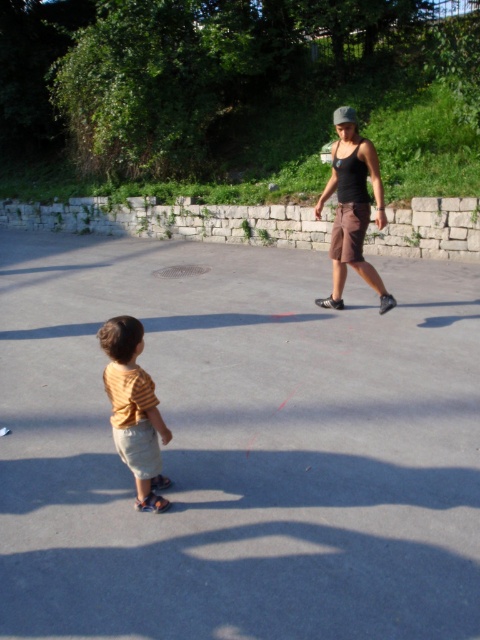
Question: Which of the following is the closest to the observer?

Choices:
 (A) yellow striped shirt at left
 (B) black matte tank top at center

Answer: (A)

Question: Is yellow striped shirt at left bigger than black matte tank top at center?

Choices:
 (A) no
 (B) yes

Answer: (A)

Question: Can you confirm if yellow striped shirt at left is wider than black matte tank top at center?

Choices:
 (A) no
 (B) yes

Answer: (A)

Question: Is yellow striped shirt at left thinner than black matte tank top at center?

Choices:
 (A) no
 (B) yes

Answer: (B)

Question: Among these points, which one is nearest to the camera?

Choices:
 (A) (331, 298)
 (B) (116, 353)

Answer: (B)